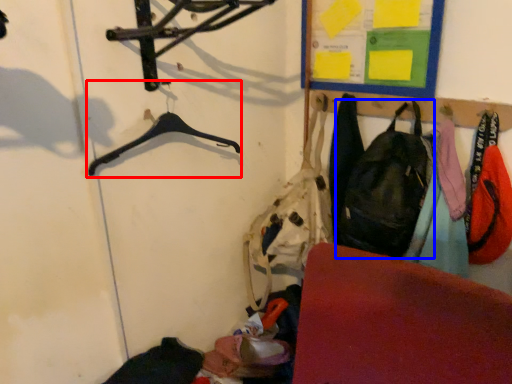
Question: Among these objects, which one is farthest to the camera, hanger (highlighted by a red box) or shoulder bag (highlighted by a blue box)?

Choices:
 (A) hanger
 (B) shoulder bag

Answer: (B)